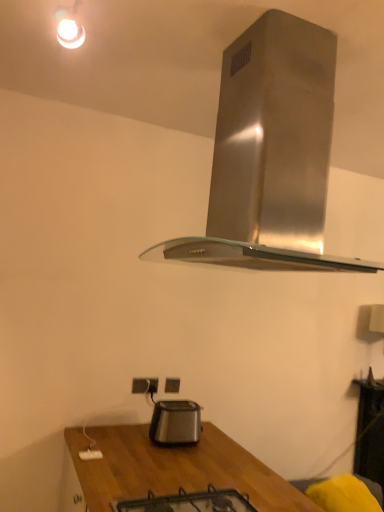
Question: From the image's perspective, is matte black electric outlet at lower center, marked as the 2th electric outlet in a front-to-back arrangement, over satin black toaster at lower center?

Choices:
 (A) yes
 (B) no

Answer: (A)

Question: From a real-world perspective, does matte black electric outlet at lower center, the 1th electric outlet viewed from the back, stand above satin black toaster at lower center?

Choices:
 (A) yes
 (B) no

Answer: (A)

Question: Can you confirm if matte black electric outlet at lower center, the 1th electric outlet viewed from the back, is wider than satin black toaster at lower center?

Choices:
 (A) yes
 (B) no

Answer: (B)

Question: From the image's perspective, does matte black electric outlet at lower center, marked as the 2th electric outlet in a front-to-back arrangement, appear lower than satin black toaster at lower center?

Choices:
 (A) no
 (B) yes

Answer: (A)

Question: Can you confirm if matte black electric outlet at lower center, the 1th electric outlet viewed from the back, is shorter than satin black toaster at lower center?

Choices:
 (A) yes
 (B) no

Answer: (A)

Question: Is matte black electric outlet at lower center, the 1th electric outlet viewed from the back, not close to satin black toaster at lower center?

Choices:
 (A) yes
 (B) no

Answer: (B)

Question: Could you tell me if white plastic electric outlet at lower center, which is the 2th electric outlet in back-to-front order, is facing matte black electric outlet at lower center, arranged as the second electric outlet when viewed from the left?

Choices:
 (A) no
 (B) yes

Answer: (A)

Question: Does white plastic electric outlet at lower center, the 1th electric outlet when ordered from front to back, have a lesser width compared to matte black electric outlet at lower center, marked as the 2th electric outlet in a front-to-back arrangement?

Choices:
 (A) no
 (B) yes

Answer: (A)

Question: Can you confirm if white plastic electric outlet at lower center, arranged as the first electric outlet when viewed from the left, is smaller than matte black electric outlet at lower center, arranged as the second electric outlet when viewed from the left?

Choices:
 (A) no
 (B) yes

Answer: (A)

Question: Considering the relative sizes of white plastic electric outlet at lower center, which is the 2th electric outlet in back-to-front order, and matte black electric outlet at lower center, the 1th electric outlet viewed from the back, in the image provided, is white plastic electric outlet at lower center, which is the 2th electric outlet in back-to-front order, shorter than matte black electric outlet at lower center, the 1th electric outlet viewed from the back,?

Choices:
 (A) yes
 (B) no

Answer: (B)

Question: Is white plastic electric outlet at lower center, arranged as the first electric outlet when viewed from the left, to the right of matte black electric outlet at lower center, placed as the first electric outlet when sorted from right to left, from the viewer's perspective?

Choices:
 (A) yes
 (B) no

Answer: (B)

Question: From the image's perspective, is white plastic electric outlet at lower center, arranged as the first electric outlet when viewed from the left, under matte black electric outlet at lower center, marked as the 2th electric outlet in a front-to-back arrangement?

Choices:
 (A) yes
 (B) no

Answer: (B)

Question: From the image's perspective, is satin black toaster at lower center on top of stainless steel range hood at upper center?

Choices:
 (A) no
 (B) yes

Answer: (A)